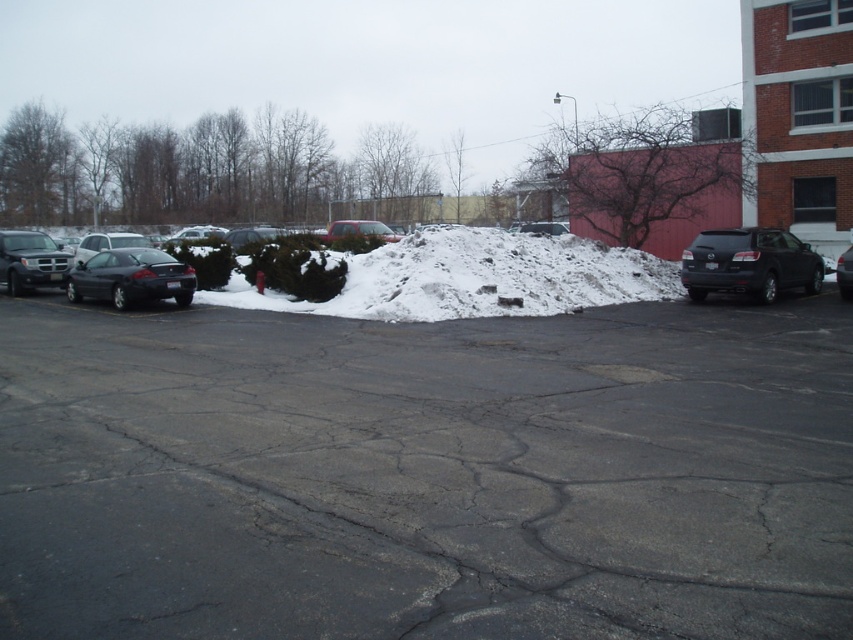
Who is positioned more to the right, white snow at center or black glossy sedan at right?

From the viewer's perspective, black glossy sedan at right appears more on the right side.

Which is above, white snow at center or black glossy sedan at right?

black glossy sedan at right

Between point (631, 269) and point (843, 276), which one is positioned in front?

Positioned in front is point (843, 276).

The height and width of the screenshot is (640, 853). I want to click on white snow at center, so click(x=495, y=276).

Is white snow at center further to the viewer compared to matte black suv at right?

No, it is not.

What do you see at coordinates (495, 276) in the screenshot? This screenshot has width=853, height=640. I see `white snow at center` at bounding box center [495, 276].

Is point (456, 275) positioned before point (804, 282)?

Yes, point (456, 275) is closer to viewer.

Identify the location of white snow at center. (495, 276).

Can you confirm if matte black truck at left is wider than matte black car at center?

Yes.

Measure the distance between matte black truck at left and camera.

matte black truck at left is 22.65 meters away from camera.

The width and height of the screenshot is (853, 640). Identify the location of matte black truck at left. (32, 260).